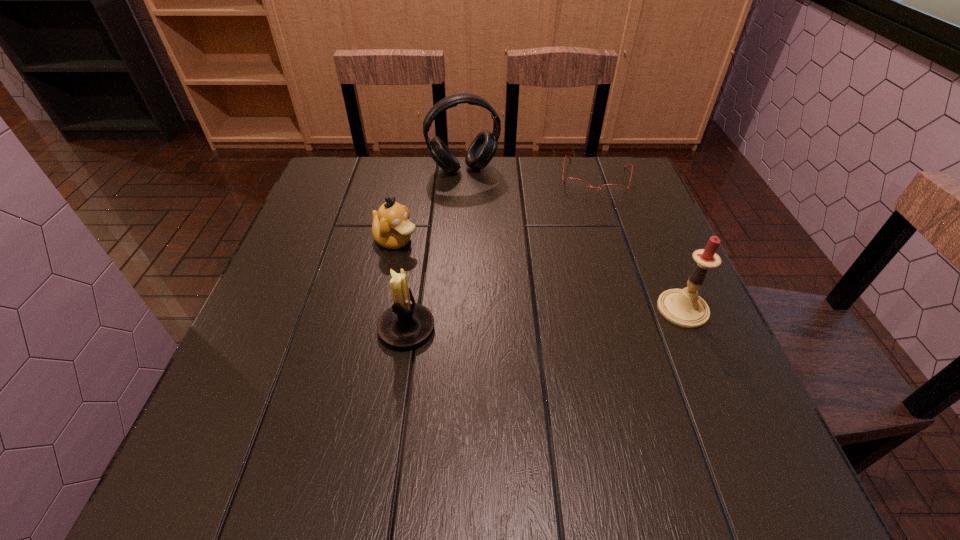
Identify the location of free space located on the face of the duckling. (514, 303).

Where is `vacant space located on the earcups of the headset`? vacant space located on the earcups of the headset is located at coordinates (499, 238).

I want to click on vacant area situated 0.190m on the earcups of the headset, so click(491, 221).

I want to click on vacant position located 0.230m on the earcups of the headset, so click(495, 231).

Identify the location of blank space located 0.060m on the lenses of the spectacles. The height and width of the screenshot is (540, 960). (590, 212).

This screenshot has width=960, height=540. Identify the location of free space located on the lenses of the spectacles. (589, 217).

Locate an element on the screen. The width and height of the screenshot is (960, 540). free space located 0.120m on the lenses of the spectacles is located at coordinates (588, 226).

Image resolution: width=960 pixels, height=540 pixels. In order to click on headset present at the far edge in this screenshot , I will do `click(483, 148)`.

You are a GUI agent. You are given a task and a screenshot of the screen. Output one action in this format:
    pyautogui.click(x=<x>, y=<y>)
    Task: Click on the spectacles located at the far edge
    
    Given the screenshot: What is the action you would take?
    pyautogui.click(x=576, y=185)

Where is `candle positioned at the right edge`? Image resolution: width=960 pixels, height=540 pixels. candle positioned at the right edge is located at coordinates tap(684, 307).